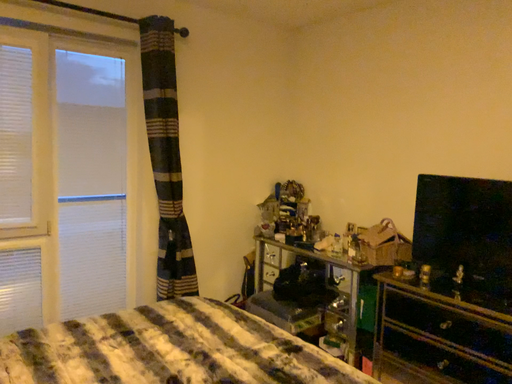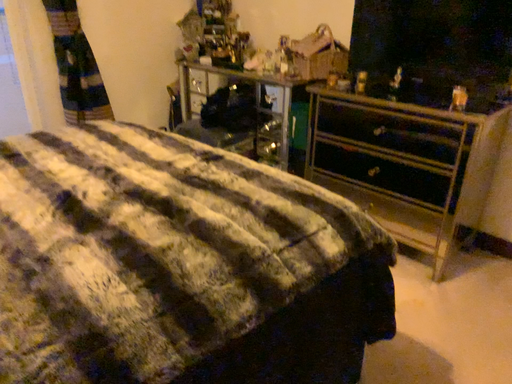
Question: How did the camera likely rotate when shooting the video?

Choices:
 (A) rotated downward
 (B) rotated upward

Answer: (A)